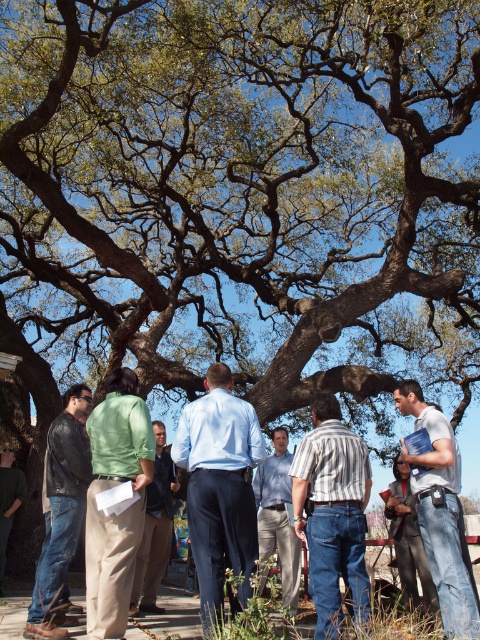
You are a photographer trying to capture a candid shot of the group under the tree. You notice a specific point at coordinates point (x=333, y=513) on the striped cotton shirt at center. If you want to ensure this point is in focus, where should you aim your camera lens?

You should aim your camera lens at the striped cotton shirt at center because the point (x=333, y=513) is located on it.

You are a photographer trying to capture a group photo of the blue cotton shirt at center and the green cotton shirt at center. Since you want both shirts to appear the same height in the photo, which person should you position closer to the camera?

The blue cotton shirt at center is shorter than the green cotton shirt at center. To make them appear the same height in the photo, position the blue cotton shirt at center closer to the camera than the green cotton shirt at center.